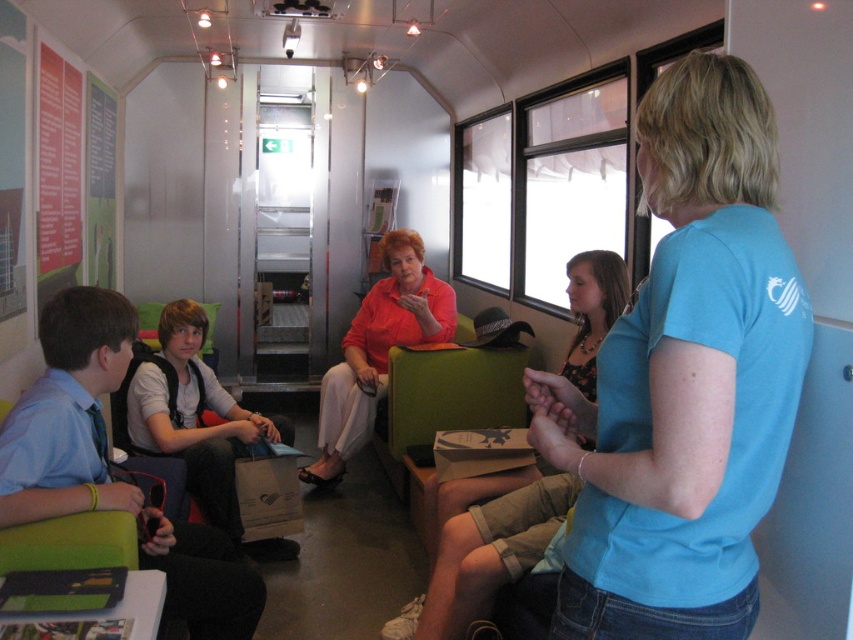
Is matte black backpack at left positioned before matte orange shirt at center?

Yes, it is.

Is matte black backpack at left wider than matte orange shirt at center?

No, matte black backpack at left is not wider than matte orange shirt at center.

Image resolution: width=853 pixels, height=640 pixels. Find the location of `matte black backpack at left`. matte black backpack at left is located at coordinates (108, 465).

Is point (747, 442) behind point (91, 147)?

No, it is not.

Between point (637, 536) and point (102, 168), which one is positioned behind?

Positioned behind is point (102, 168).

Between point (582, 429) and point (38, 253), which one is positioned in front?

Point (582, 429) is more forward.

Where is `blue cotton shirt at upper right`? Image resolution: width=853 pixels, height=640 pixels. blue cotton shirt at upper right is located at coordinates (685, 380).

Is blue cotton shirt at upper right shorter than matte black backpack at left?

Yes, blue cotton shirt at upper right is shorter than matte black backpack at left.

Measure the distance from blue cotton shirt at upper right to matte black backpack at left.

A distance of 1.30 meters exists between blue cotton shirt at upper right and matte black backpack at left.

Is point (703, 282) farther from viewer compared to point (247, 577)?

No, (703, 282) is in front of (247, 577).

At what (x,y) coordinates should I click in order to perform the action: click on blue cotton shirt at upper right. Please return your answer as a coordinate pair (x, y). Looking at the image, I should click on (685, 380).